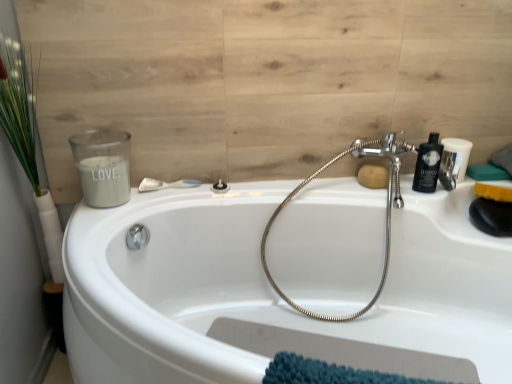
Question: Can you confirm if chrome flexible hose at upper right is taller than wooden panel at upper left?

Choices:
 (A) yes
 (B) no

Answer: (B)

Question: From a real-world perspective, is chrome flexible hose at upper right physically below wooden panel at upper left?

Choices:
 (A) yes
 (B) no

Answer: (A)

Question: Does chrome flexible hose at upper right appear on the right side of wooden panel at upper left?

Choices:
 (A) no
 (B) yes

Answer: (B)

Question: Is chrome flexible hose at upper right not inside wooden panel at upper left?

Choices:
 (A) yes
 (B) no

Answer: (A)

Question: Is chrome flexible hose at upper right wider than wooden panel at upper left?

Choices:
 (A) yes
 (B) no

Answer: (A)

Question: Considering their positions, is green leafy plant at left located in front of or behind matte black showerhead at center, the second shower from the left?

Choices:
 (A) behind
 (B) front

Answer: (B)

Question: From the image's perspective, relative to matte black showerhead at center, which is counted as the 1th shower, starting from the right, is green leafy plant at left above or below?

Choices:
 (A) below
 (B) above

Answer: (A)

Question: Is point (17, 144) closer or farther from the camera than point (224, 187)?

Choices:
 (A) farther
 (B) closer

Answer: (B)

Question: Considering the positions of green leafy plant at left and matte black showerhead at center, which is counted as the 1th shower, starting from the right, in the image, is green leafy plant at left wider or thinner than matte black showerhead at center, which is counted as the 1th shower, starting from the right,?

Choices:
 (A) thin
 (B) wide

Answer: (B)

Question: Is black plastic bottle at upper right bigger or smaller than matte black toiletry at upper right?

Choices:
 (A) big
 (B) small

Answer: (B)

Question: Is black plastic bottle at upper right inside or outside of matte black toiletry at upper right?

Choices:
 (A) inside
 (B) outside

Answer: (B)

Question: Does point (439, 160) appear closer or farther from the camera than point (442, 153)?

Choices:
 (A) closer
 (B) farther

Answer: (A)

Question: From a real-world perspective, is black plastic bottle at upper right above or below matte black toiletry at upper right?

Choices:
 (A) above
 (B) below

Answer: (A)

Question: From the image's perspective, is matte black showerhead at center, the second shower from the left, located above or below green leafy plant at left?

Choices:
 (A) below
 (B) above

Answer: (B)

Question: Relative to green leafy plant at left, is matte black showerhead at center, the second shower from the left, in front or behind?

Choices:
 (A) behind
 (B) front

Answer: (A)